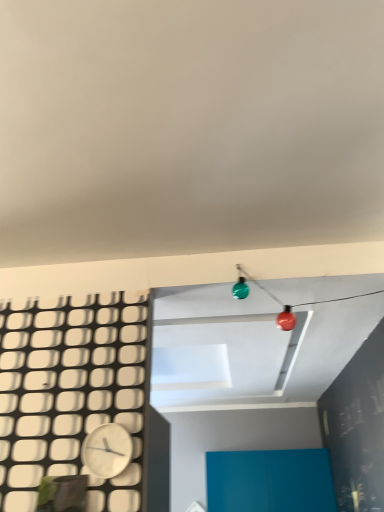
Measure the distance between point (118, 449) and camera.

They are 1.66 meters apart.

Find the location of a particular element. white matte clock at lower left is located at coordinates (107, 450).

Describe the element at coordinates (107, 450) in the screenshot. I see `white matte clock at lower left` at that location.

I want to click on white matte clock at lower left, so click(107, 450).